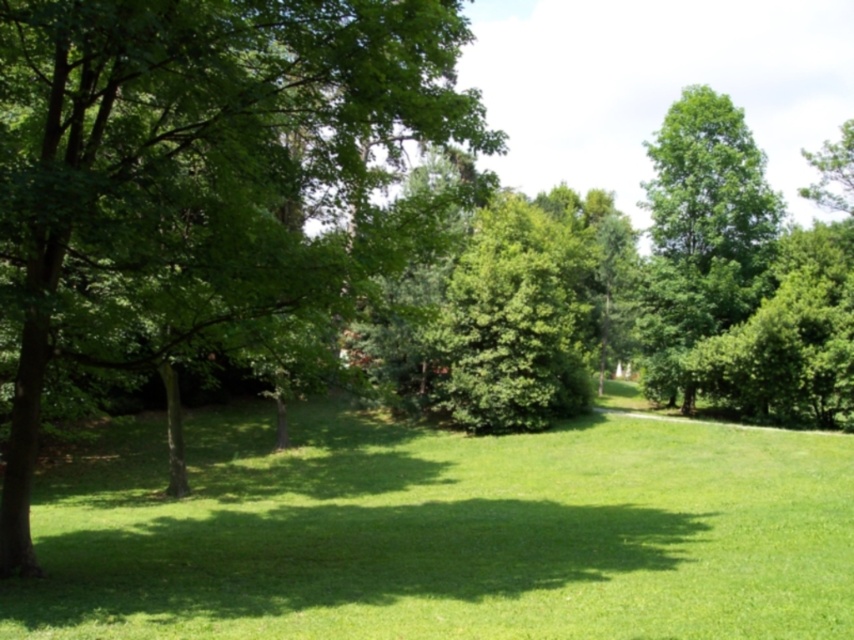
You are a landscape architect designing a new park. You want to place a small statue between the green leafy tree at left and the green leafy tree at upper right. Which tree should the statue be closer to if you want it to be under the taller tree?

The green leafy tree at upper right is taller than the green leafy tree at left, so the statue should be placed closer to the green leafy tree at upper right to be under the taller tree.

You are a gardener planning to mow the lawn. You see the green grass at center and the green leafy tree at upper right. Which area should you avoid mowing to prevent damaging the tree?

You should avoid mowing near the green leafy tree at upper right because the green grass at center is wider than the green leafy tree at upper right, meaning the tree area is narrower and closer to the tree trunk, which should not be disturbed.